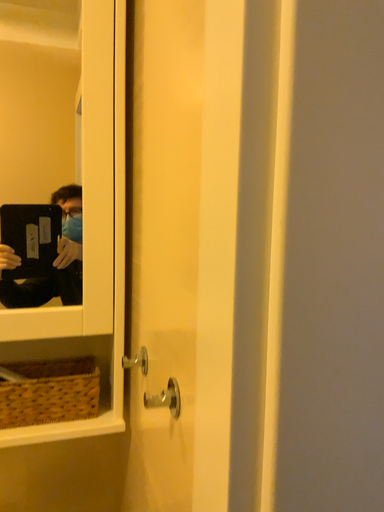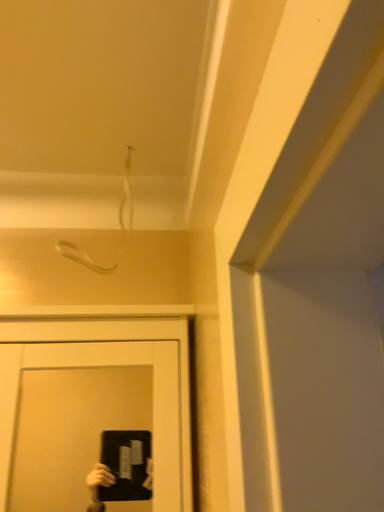
Question: How did the camera likely rotate when shooting the video?

Choices:
 (A) rotated upward
 (B) rotated downward

Answer: (A)